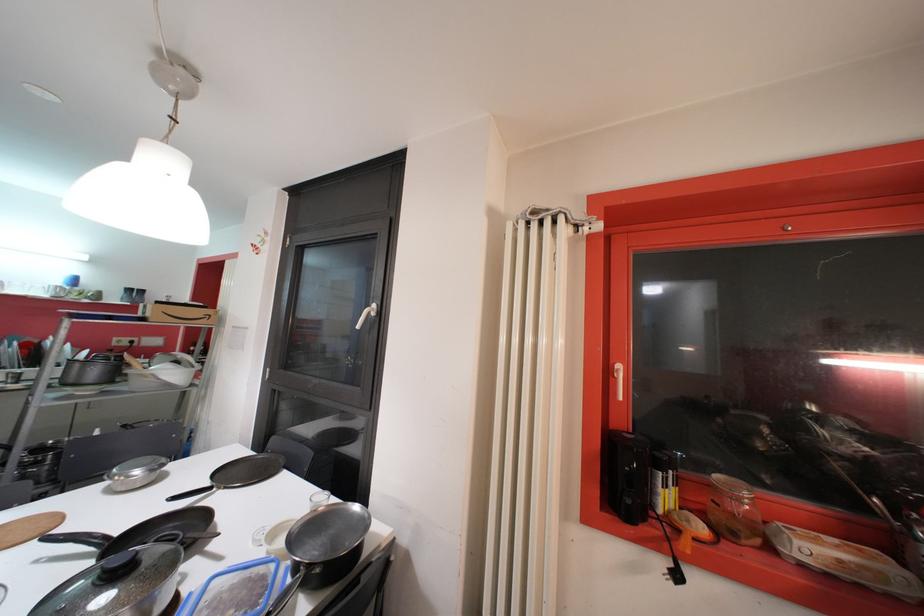
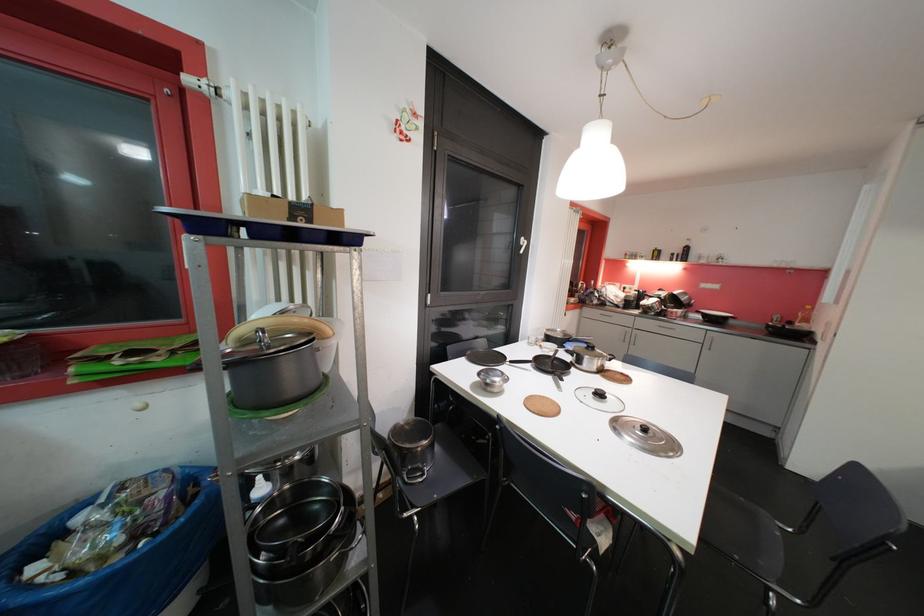
Question: I am providing you with two images of the same scene from different viewpoints. Please identify which objects are invisible in image2.

Choices:
 (A) chair sitting surface
 (B) red can nozzle
 (C) cardboard box
 (D) small drinking glass

Answer: (D)